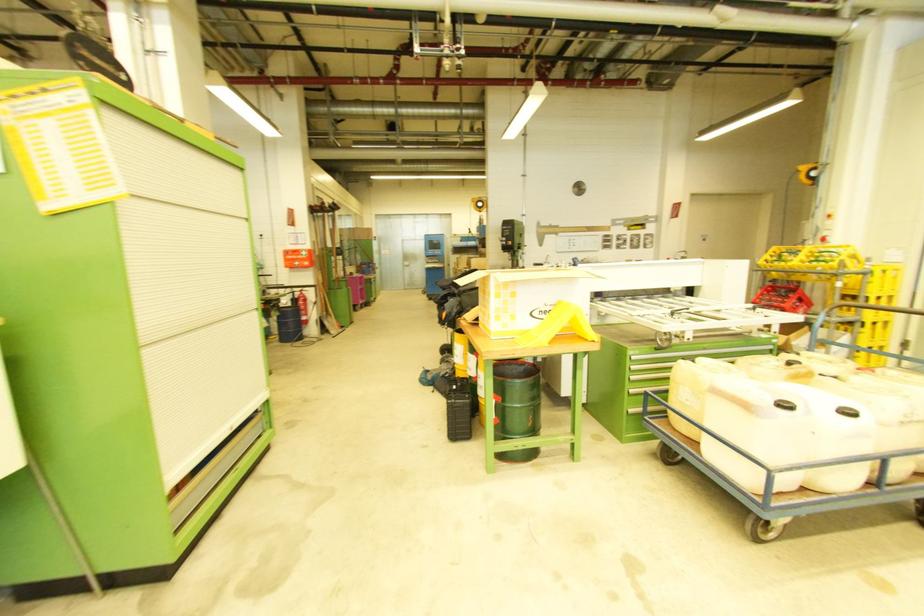
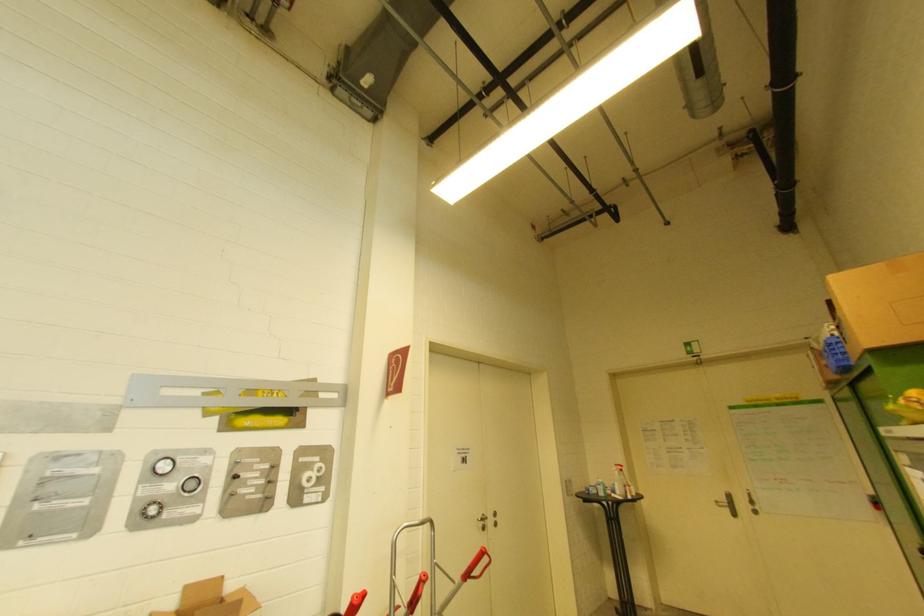
Question: I am providing you with two images of the same scene from different viewpoints. Which of the following objects are not visible in image2?

Choices:
 (A) red trolley handle
 (B) cardboard box
 (C) silver door handle
 (D) none of these

Answer: (D)